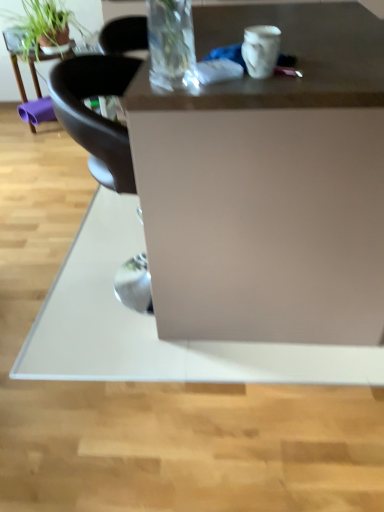
Question: From a real-world perspective, is matte white desk at center over green matte plant at upper left?

Choices:
 (A) no
 (B) yes

Answer: (A)

Question: From the image's perspective, is matte white desk at center below green matte plant at upper left?

Choices:
 (A) no
 (B) yes

Answer: (B)

Question: Are matte white desk at center and green matte plant at upper left far apart?

Choices:
 (A) no
 (B) yes

Answer: (B)

Question: Can you confirm if matte white desk at center is positioned to the right of green matte plant at upper left?

Choices:
 (A) no
 (B) yes

Answer: (B)

Question: Considering the relative positions of matte white desk at center and green matte plant at upper left in the image provided, is matte white desk at center to the left of green matte plant at upper left from the viewer's perspective?

Choices:
 (A) no
 (B) yes

Answer: (A)

Question: Considering the relative sizes of matte white desk at center and green matte plant at upper left in the image provided, is matte white desk at center shorter than green matte plant at upper left?

Choices:
 (A) yes
 (B) no

Answer: (B)

Question: Is green matte plant at upper left in contact with matte white desk at center?

Choices:
 (A) no
 (B) yes

Answer: (A)

Question: Can you confirm if green matte plant at upper left is smaller than matte white desk at center?

Choices:
 (A) yes
 (B) no

Answer: (A)

Question: Is green matte plant at upper left far from matte white desk at center?

Choices:
 (A) no
 (B) yes

Answer: (B)

Question: Is green matte plant at upper left taller than matte white desk at center?

Choices:
 (A) no
 (B) yes

Answer: (A)

Question: Is matte white desk at center located within green matte plant at upper left?

Choices:
 (A) no
 (B) yes

Answer: (A)

Question: Can we say green matte plant at upper left lies outside matte white desk at center?

Choices:
 (A) yes
 (B) no

Answer: (A)

Question: Does matte white desk at center have a lesser width compared to matte black table at upper left?

Choices:
 (A) no
 (B) yes

Answer: (A)